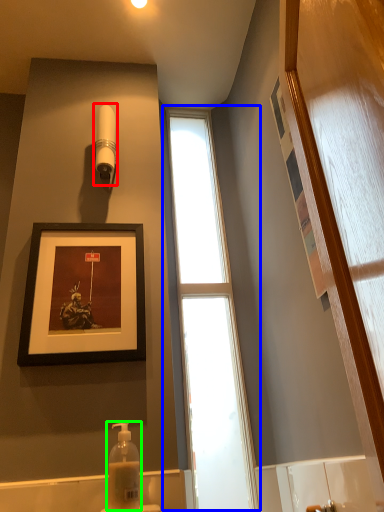
Question: Which object is positioned farthest from shower (highlighted by a red box)? Select from window (highlighted by a blue box) and soap dispenser (highlighted by a green box).

Choices:
 (A) window
 (B) soap dispenser

Answer: (B)